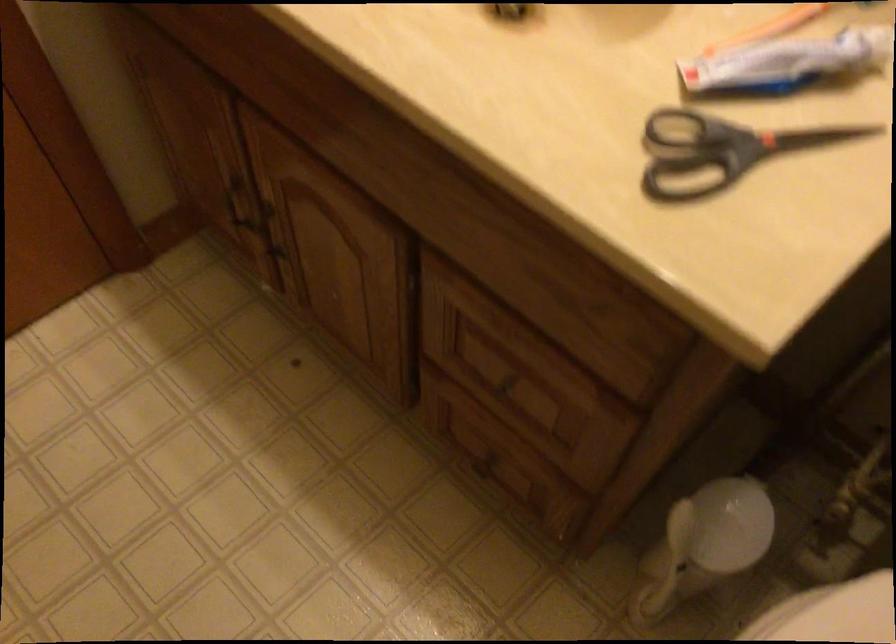
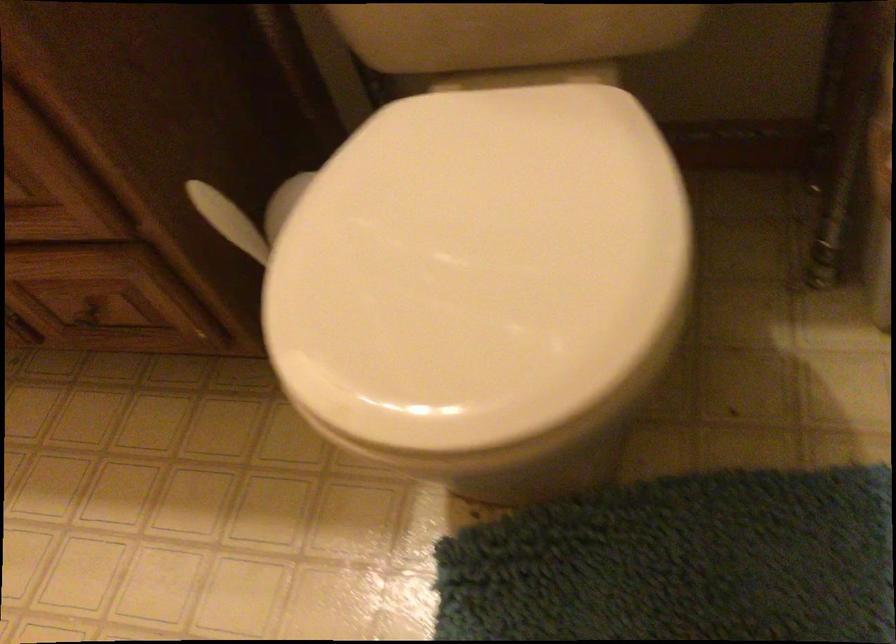
Question: How did the camera likely rotate?

Choices:
 (A) Left
 (B) Right
 (C) Up
 (D) Down

Answer: (B)